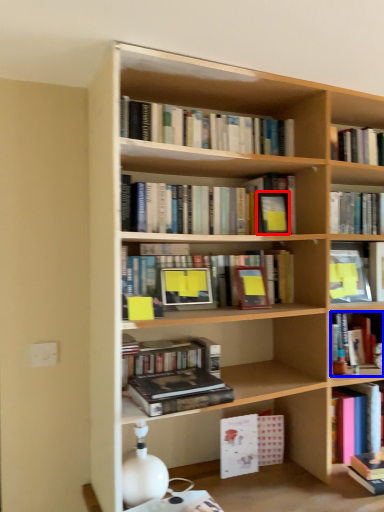
Question: Among these objects, which one is farthest to the camera, paperback book (highlighted by a red box) or book (highlighted by a blue box)?

Choices:
 (A) paperback book
 (B) book

Answer: (B)